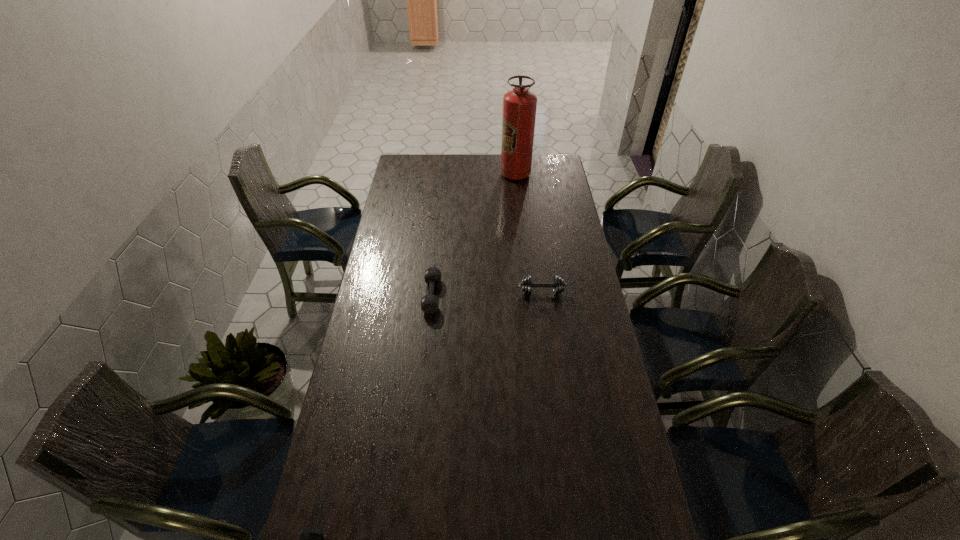
Identify the location of the tallest object. This screenshot has width=960, height=540. (519, 105).

This screenshot has height=540, width=960. What are the coordinates of `the farthest object` in the screenshot? It's located at (519, 105).

Locate an element on the screen. Image resolution: width=960 pixels, height=540 pixels. the rightmost dumbbell is located at coordinates (558, 284).

Find the location of a particular element. The width and height of the screenshot is (960, 540). the second tallest object is located at coordinates (558, 284).

This screenshot has height=540, width=960. In order to click on the second dumbbell from right to left in this screenshot , I will do `click(429, 303)`.

In order to click on free space located on the label side of the tallest object in this screenshot , I will do `click(449, 174)`.

You are a GUI agent. You are given a task and a screenshot of the screen. Output one action in this format:
    pyautogui.click(x=<x>, y=<y>)
    Task: Click on the vacant space situated on the label side of the tallest object
    The height and width of the screenshot is (540, 960).
    Given the screenshot: What is the action you would take?
    pyautogui.click(x=456, y=174)

Locate an element on the screen. free spot located on the label side of the tallest object is located at coordinates (480, 174).

Image resolution: width=960 pixels, height=540 pixels. In order to click on free location located 0.110m on the left of the rightmost dumbbell in this screenshot , I will do (491, 292).

Where is `blank area located on the back of the second object from left to right`? blank area located on the back of the second object from left to right is located at coordinates (435, 265).